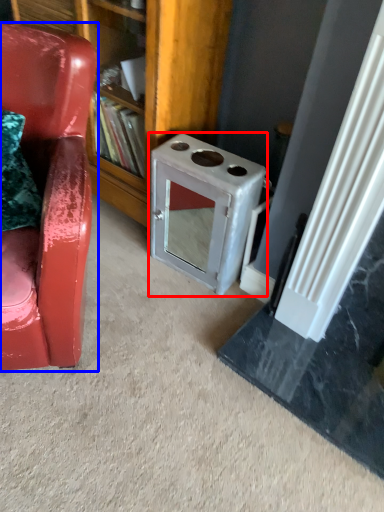
Question: Which object appears closest to the camera in this image, appliance (highlighted by a red box) or chair (highlighted by a blue box)?

Choices:
 (A) appliance
 (B) chair

Answer: (B)